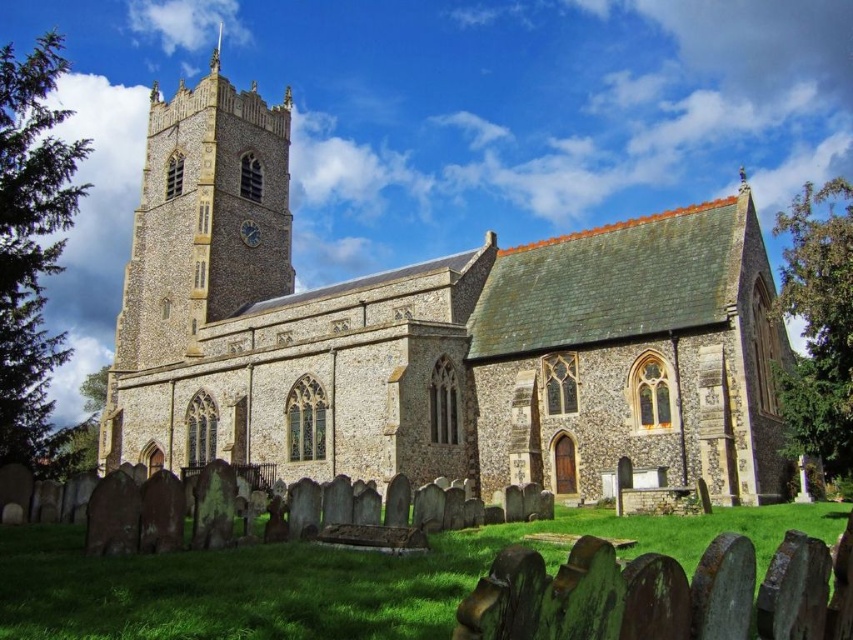
You are a tourist standing in front of the stone church at center and the brown stone clock tower at upper left. Which structure is located higher up in the image?

The brown stone clock tower at upper left is positioned higher up in the image than the stone church at center.

You are standing in the graveyard in front of the historic stone church. If you face the church, which direction should you walk to reach the stone church at center?

Since the stone church at center is located at coordinates point (436, 339), you should walk forward towards the center of the graveyard to reach it.

You are standing in front of the historic stone church and want to take a photo that includes both the brown stone clock tower at upper left and the metallic clock face at upper center. Since you want to capture their relative sizes accurately, which object should appear larger in your photo?

The brown stone clock tower at upper left should appear larger in the photo because it has a greater height compared to the metallic clock face at upper center.